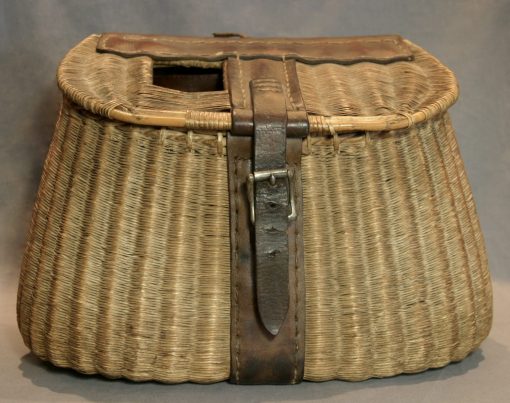
I want to click on wall, so [31, 155].